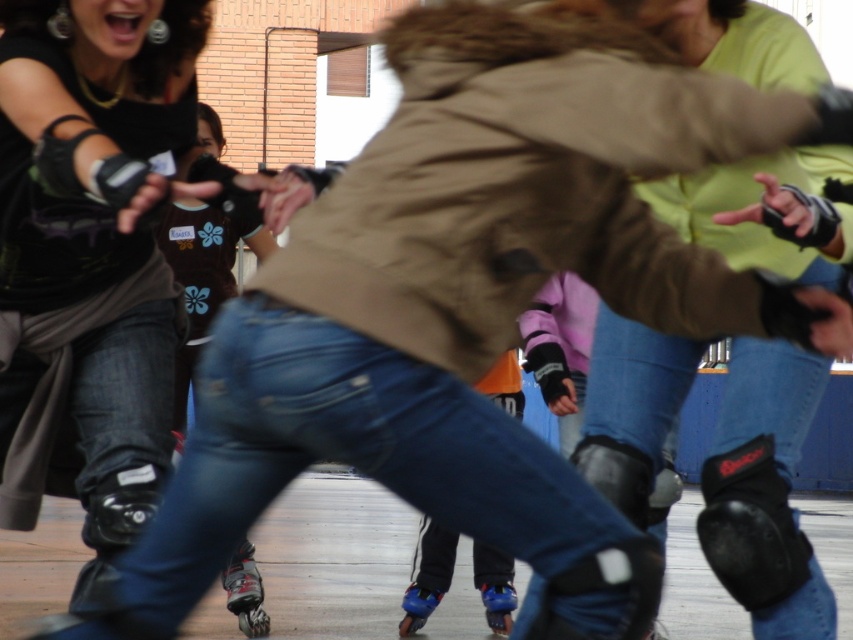
The image size is (853, 640). Describe the element at coordinates (498, 605) in the screenshot. I see `blue plastic roller skate at lower center` at that location.

Can you confirm if blue plastic roller skate at lower center is thinner than blue matte roller skate at lower center?

Indeed, blue plastic roller skate at lower center has a lesser width compared to blue matte roller skate at lower center.

Does point (495, 586) lie in front of point (410, 616)?

No, it is behind (410, 616).

Where is `blue plastic roller skate at lower center`? The image size is (853, 640). blue plastic roller skate at lower center is located at coordinates (498, 605).

Between point (140, 436) and point (403, 595), which one is positioned in front?

Point (140, 436)

Is matte black knee pads at lower left smaller than blue matte roller skate at lower center?

Actually, matte black knee pads at lower left might be larger than blue matte roller skate at lower center.

Locate an element on the screen. The height and width of the screenshot is (640, 853). matte black knee pads at lower left is located at coordinates (90, 252).

Is the position of shiny black roller skate at lower center more distant than that of blue plastic roller skate at lower center?

No, it is in front of blue plastic roller skate at lower center.

Is shiny black roller skate at lower center smaller than blue plastic roller skate at lower center?

No, shiny black roller skate at lower center is not smaller than blue plastic roller skate at lower center.

Measure the distance between shiny black roller skate at lower center and camera.

shiny black roller skate at lower center and camera are 8.72 meters apart from each other.

You are a GUI agent. You are given a task and a screenshot of the screen. Output one action in this format:
    pyautogui.click(x=<x>, y=<y>)
    Task: Click on the shiny black roller skate at lower center
    Image resolution: width=853 pixels, height=640 pixels.
    Given the screenshot: What is the action you would take?
    pyautogui.click(x=245, y=592)